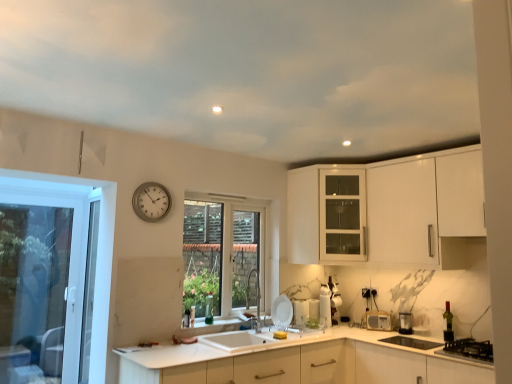
Question: Is clear glass window at center, placed as the second window when sorted from left to right, located outside white glossy microwave at lower center, which appears as the 2th appliance when viewed from the right?

Choices:
 (A) yes
 (B) no

Answer: (A)

Question: From a real-world perspective, is clear glass window at center, placed as the second window when sorted from left to right, below white glossy microwave at lower center, which appears as the 2th appliance when viewed from the right?

Choices:
 (A) yes
 (B) no

Answer: (B)

Question: Does clear glass window at center, placed as the second window when sorted from left to right, have a greater width compared to white glossy microwave at lower center, which is the 3th appliance in left-to-right order?

Choices:
 (A) yes
 (B) no

Answer: (A)

Question: Is clear glass window at center, placed as the second window when sorted from left to right, behind white glossy microwave at lower center, which appears as the 2th appliance when viewed from the right?

Choices:
 (A) no
 (B) yes

Answer: (A)

Question: Is clear glass window at center, placed as the second window when sorted from left to right, smaller than white glossy microwave at lower center, which appears as the 2th appliance when viewed from the right?

Choices:
 (A) yes
 (B) no

Answer: (B)

Question: Is clear glass window at center, the first window positioned from the right, beside white glossy microwave at lower center, which appears as the 2th appliance when viewed from the right?

Choices:
 (A) yes
 (B) no

Answer: (B)

Question: Is white glossy plate at sink, placed as the fourth appliance when sorted from right to left, far away from silver metallic clock at upper left?

Choices:
 (A) no
 (B) yes

Answer: (B)

Question: Can you confirm if white glossy plate at sink, placed as the fourth appliance when sorted from right to left, is bigger than silver metallic clock at upper left?

Choices:
 (A) no
 (B) yes

Answer: (A)

Question: From a real-world perspective, is white glossy plate at sink, placed as the fourth appliance when sorted from right to left, located higher than silver metallic clock at upper left?

Choices:
 (A) no
 (B) yes

Answer: (A)

Question: Can silver metallic clock at upper left be found inside white glossy plate at sink, placed as the fourth appliance when sorted from right to left?

Choices:
 (A) no
 (B) yes

Answer: (A)

Question: Considering the relative sizes of white glossy plate at sink, placed as the fourth appliance when sorted from right to left, and silver metallic clock at upper left in the image provided, is white glossy plate at sink, placed as the fourth appliance when sorted from right to left, thinner than silver metallic clock at upper left?

Choices:
 (A) yes
 (B) no

Answer: (A)

Question: From the image's perspective, does white glossy plate at sink, placed as the fourth appliance when sorted from right to left, appear higher than silver metallic clock at upper left?

Choices:
 (A) no
 (B) yes

Answer: (A)

Question: Is metallic silver toaster at lower right, positioned as the 1th appliance in right-to-left order, beside white glossy microwave at lower center, which is the 3th appliance in left-to-right order?

Choices:
 (A) no
 (B) yes

Answer: (A)